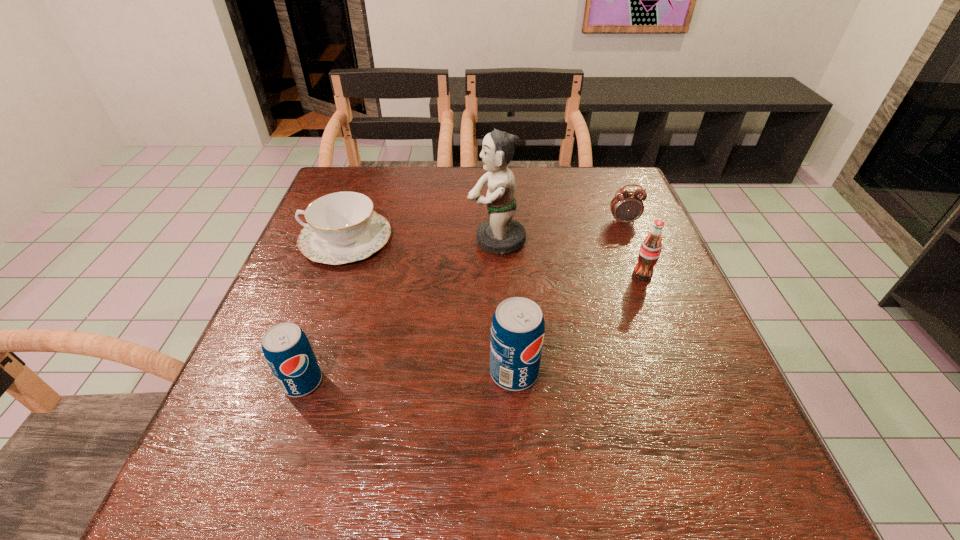
Locate an element on the screen. The height and width of the screenshot is (540, 960). vacant position located on the front-facing side of the tallest object is located at coordinates [437, 240].

Locate an element on the screen. This screenshot has width=960, height=540. vacant space located on the front-facing side of the tallest object is located at coordinates (396, 240).

Identify the location of vacant space located on the front of the rightmost soda. The width and height of the screenshot is (960, 540). (673, 352).

Find the location of a particular element. The height and width of the screenshot is (540, 960). pop that is at the left edge is located at coordinates (286, 348).

This screenshot has height=540, width=960. What are the coordinates of `chinaware at the left edge` in the screenshot? It's located at (342, 227).

Where is `alarm clock that is at the right edge`? The image size is (960, 540). alarm clock that is at the right edge is located at coordinates (627, 206).

Find the location of a particular element. The height and width of the screenshot is (540, 960). soda at the right edge is located at coordinates (649, 253).

This screenshot has width=960, height=540. Identify the location of object located at the near left corner. (286, 348).

This screenshot has height=540, width=960. What are the coordinates of `free spot at the far edge of the desktop` in the screenshot? It's located at (470, 184).

Find the location of a particular element. This screenshot has height=540, width=960. free space at the near edge of the desktop is located at coordinates (636, 396).